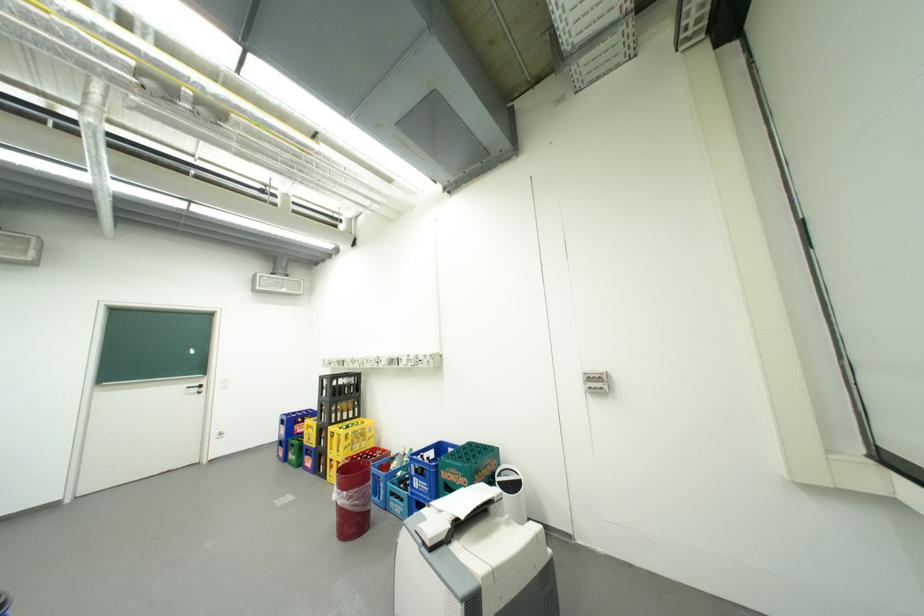
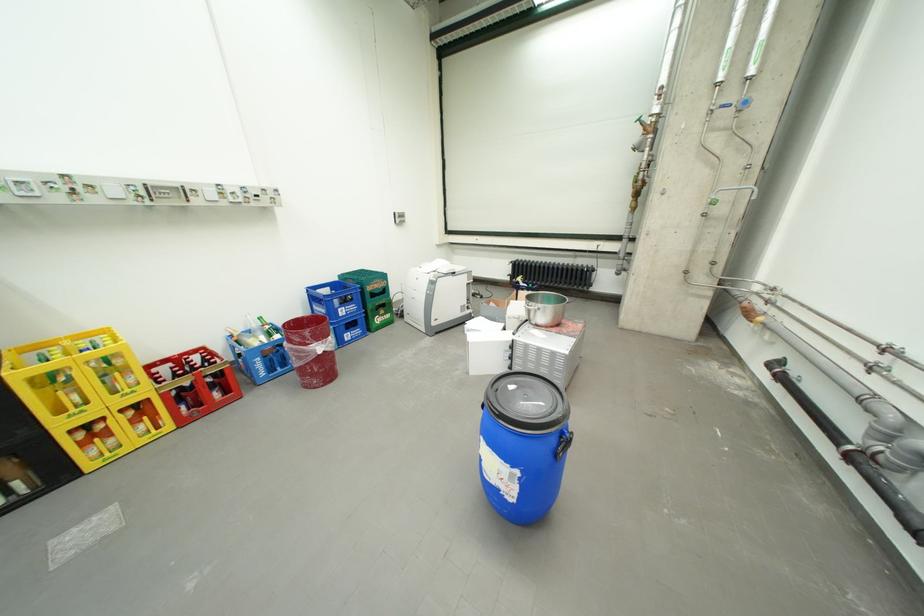
Find the pixel in the second image that matches point (464, 475) in the first image.

(386, 285)